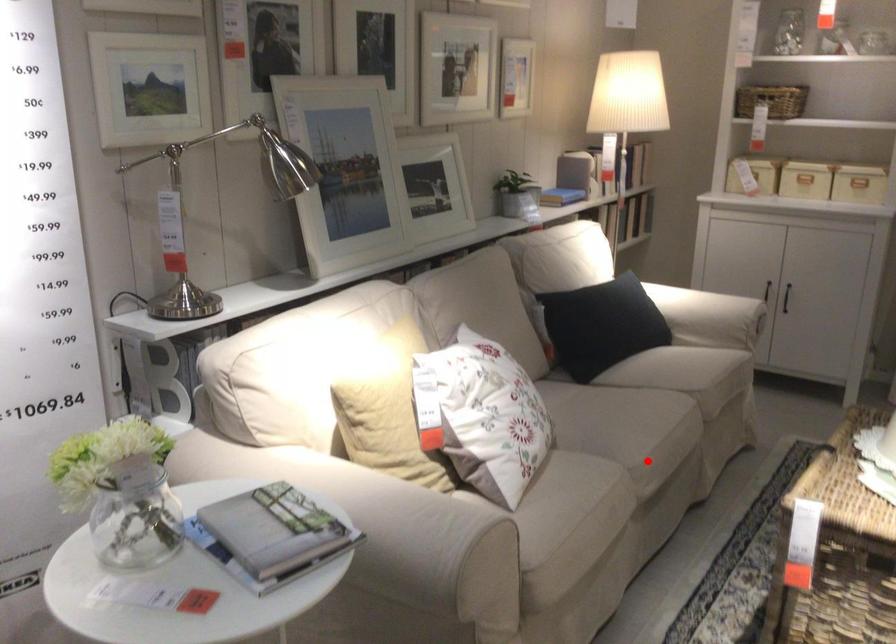
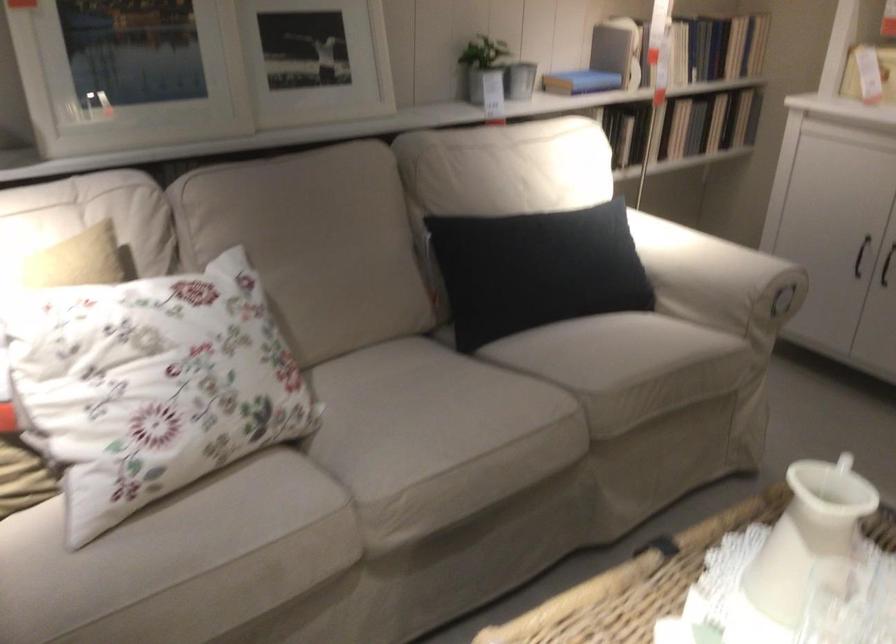
Question: I am providing you with two images of the same scene from different viewpoints. In image1, a red point is highlighted. Considering the same 3D point in image2, which of the following is correct?

Choices:
 (A) It is closer
 (B) It is farther

Answer: (A)